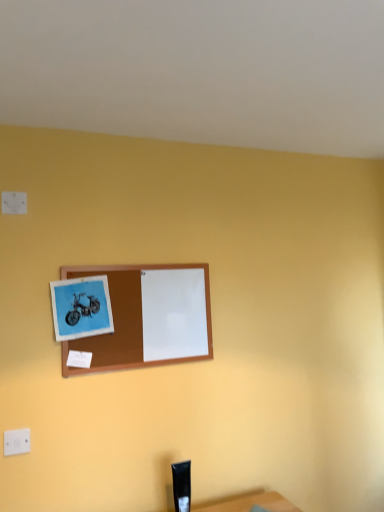
This screenshot has width=384, height=512. Describe the element at coordinates (16, 442) in the screenshot. I see `white plastic electric outlet at lower left` at that location.

Measure the distance between point (x=23, y=452) and camera.

Point (x=23, y=452) and camera are 1.50 meters apart from each other.

You are a GUI agent. You are given a task and a screenshot of the screen. Output one action in this format:
    pyautogui.click(x=<x>, y=<y>)
    Task: Click on the white plastic electric outlet at lower left
    
    Given the screenshot: What is the action you would take?
    pyautogui.click(x=16, y=442)

The width and height of the screenshot is (384, 512). Find the location of `brown wooden picture frame at center`. brown wooden picture frame at center is located at coordinates (140, 315).

What do you see at coordinates (140, 315) in the screenshot? I see `brown wooden picture frame at center` at bounding box center [140, 315].

Where is `white plastic electric outlet at lower left`? This screenshot has height=512, width=384. white plastic electric outlet at lower left is located at coordinates (16, 442).

Considering the relative positions of brown wooden picture frame at center and white plastic electric outlet at lower left in the image provided, is brown wooden picture frame at center to the left of white plastic electric outlet at lower left from the viewer's perspective?

In fact, brown wooden picture frame at center is to the right of white plastic electric outlet at lower left.

Is brown wooden picture frame at center positioned in front of white plastic electric outlet at lower left?

That is False.

Does point (136, 333) appear closer or farther from the camera than point (23, 432)?

Point (136, 333) appears to be farther away from the viewer than point (23, 432).

From the image's perspective, is brown wooden picture frame at center above or below white plastic electric outlet at lower left?

Clearly, from the image's perspective, brown wooden picture frame at center is above white plastic electric outlet at lower left.

From a real-world perspective, which is physically below, brown wooden picture frame at center or white plastic electric outlet at lower left?

From a 3D spatial view, white plastic electric outlet at lower left is below.

Looking at their sizes, would you say brown wooden picture frame at center is wider or thinner than white plastic electric outlet at lower left?

Clearly, brown wooden picture frame at center has more width compared to white plastic electric outlet at lower left.

Between brown wooden picture frame at center and white plastic electric outlet at lower left, which one has more height?

Standing taller between the two is brown wooden picture frame at center.

Can you confirm if brown wooden picture frame at center is smaller than white plastic electric outlet at lower left?

No.

Would you say brown wooden picture frame at center contains white plastic electric outlet at lower left?

Definitely not — white plastic electric outlet at lower left is not inside brown wooden picture frame at center.

Is brown wooden picture frame at center far away from white plastic electric outlet at lower left?

They are positioned close to each other.

Is brown wooden picture frame at center oriented towards white plastic electric outlet at lower left?

No, brown wooden picture frame at center is not aimed at white plastic electric outlet at lower left.

Measure the distance from brown wooden picture frame at center to white plastic electric outlet at lower left.

They are 22.03 inches apart.

Identify the location of picture frame above the white plastic electric outlet at lower left (from the image's perspective). Image resolution: width=384 pixels, height=512 pixels. (140, 315).

Between white plastic electric outlet at lower left and brown wooden picture frame at center, which one appears on the left side from the viewer's perspective?

white plastic electric outlet at lower left.

Who is more distant, white plastic electric outlet at lower left or brown wooden picture frame at center?

Positioned behind is brown wooden picture frame at center.

Is point (14, 438) closer to viewer compared to point (146, 359)?

Yes.

From the image's perspective, relative to brown wooden picture frame at center, is white plastic electric outlet at lower left above or below?

white plastic electric outlet at lower left is below brown wooden picture frame at center.

From a real-world perspective, is white plastic electric outlet at lower left physically located above or below brown wooden picture frame at center?

From a real-world perspective, white plastic electric outlet at lower left is physically below brown wooden picture frame at center.

Which of these two, white plastic electric outlet at lower left or brown wooden picture frame at center, is thinner?

white plastic electric outlet at lower left.

Considering the sizes of objects white plastic electric outlet at lower left and brown wooden picture frame at center in the image provided, who is taller, white plastic electric outlet at lower left or brown wooden picture frame at center?

brown wooden picture frame at center is taller.

Does white plastic electric outlet at lower left have a smaller size compared to brown wooden picture frame at center?

Indeed, white plastic electric outlet at lower left has a smaller size compared to brown wooden picture frame at center.

Can we say white plastic electric outlet at lower left lies outside brown wooden picture frame at center?

Absolutely, white plastic electric outlet at lower left is external to brown wooden picture frame at center.

Are white plastic electric outlet at lower left and brown wooden picture frame at center located far from each other?

white plastic electric outlet at lower left is near brown wooden picture frame at center, not far away.

Is white plastic electric outlet at lower left positioned with its back to brown wooden picture frame at center?

No, white plastic electric outlet at lower left is not facing away from brown wooden picture frame at center.

Locate an element on the screen. This screenshot has height=512, width=384. picture frame that is behind the white plastic electric outlet at lower left is located at coordinates (140, 315).

Where is `picture frame behind the white plastic electric outlet at lower left`? picture frame behind the white plastic electric outlet at lower left is located at coordinates (140, 315).

Find the location of a particular element. Image resolution: width=384 pixels, height=512 pixels. electric outlet on the left of brown wooden picture frame at center is located at coordinates (16, 442).